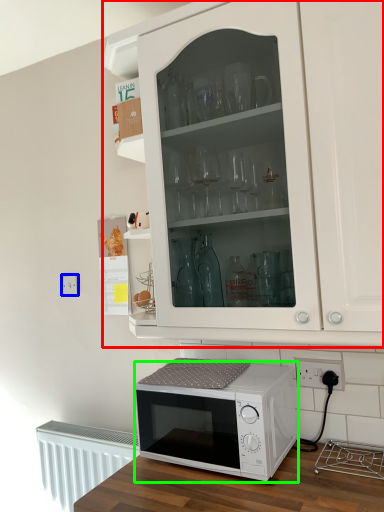
Question: Which object is the farthest from cabinetry (highlighted by a red box)? Choose among these: electric outlet (highlighted by a blue box) or microwave oven (highlighted by a green box).

Choices:
 (A) electric outlet
 (B) microwave oven

Answer: (A)